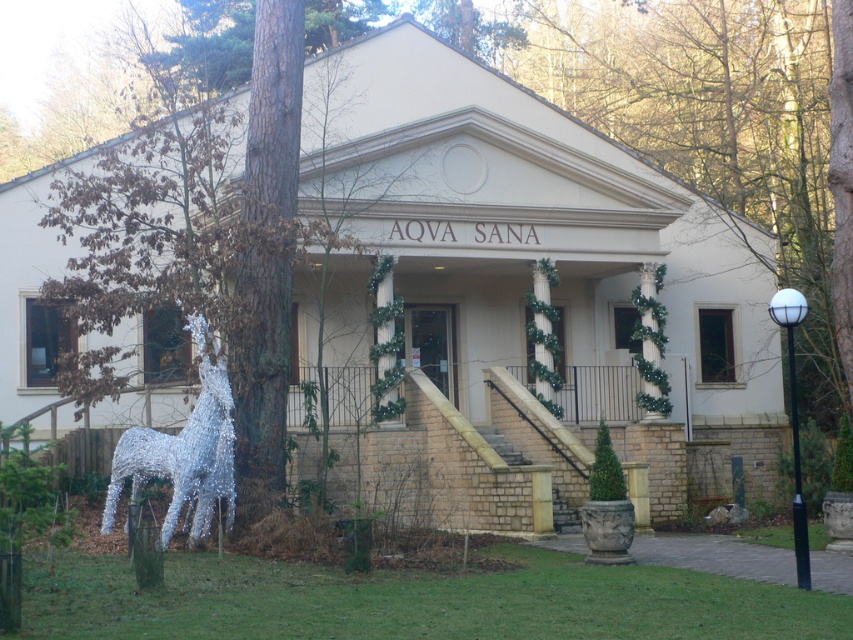
Based on the photo, you are a visitor approaching the AQVA SANA building and notice both the brown textured tree at left and the silver wire horse at left. Which object is closer to the entrance?

The brown textured tree at left is closer to the entrance because it is positioned over the silver wire horse at left, indicating it is in front.

You are a delivery person trying to park your 5.5 feet wide delivery van between the brown textured tree at left and the silver wire horse at left. Can you fit your van there?

The distance between the brown textured tree at left and the silver wire horse at left is 5.45 feet, which is slightly less than the van width of 5.5 feet. Therefore, the van cannot fit between them.